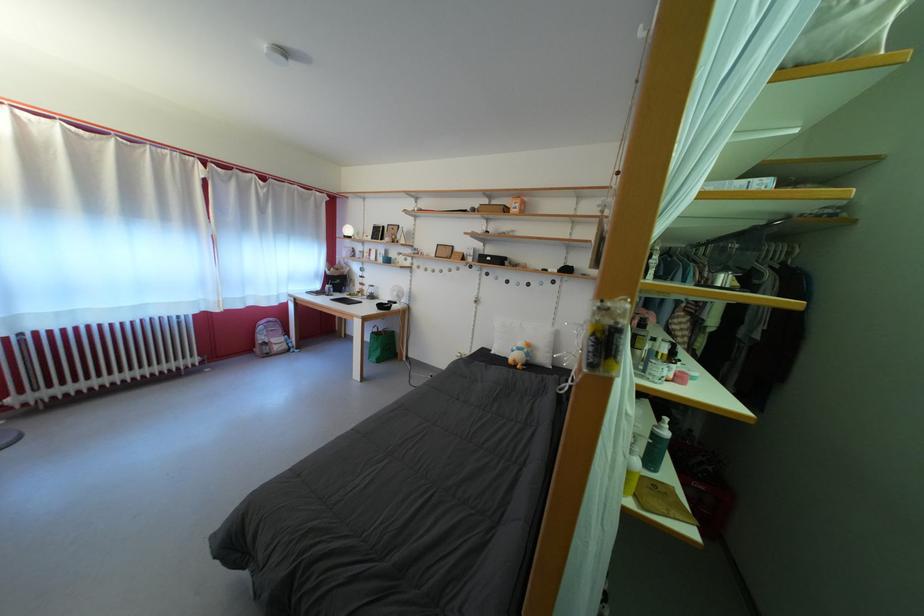
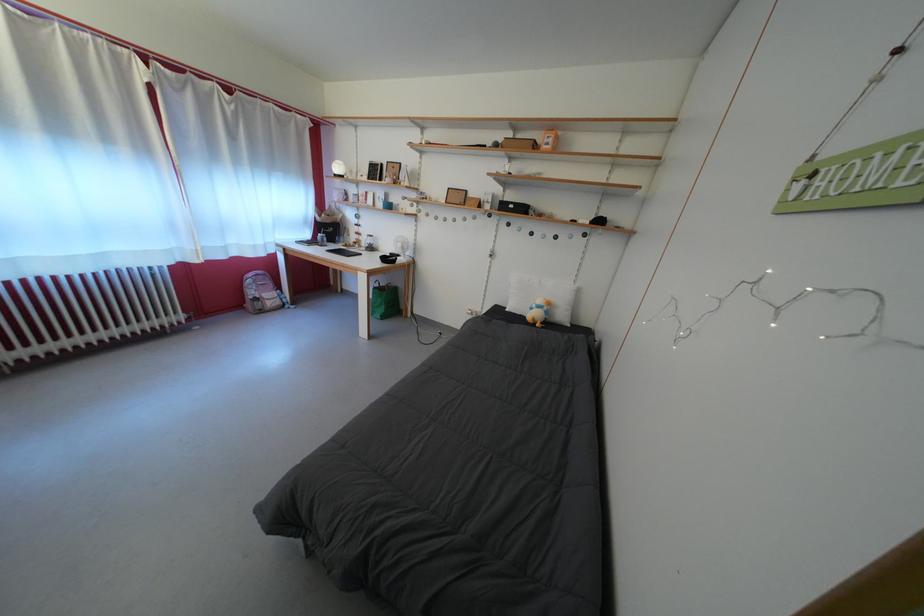
The point at [393,305] is marked in the first image. Where is the corresponding point in the second image?

(394, 257)